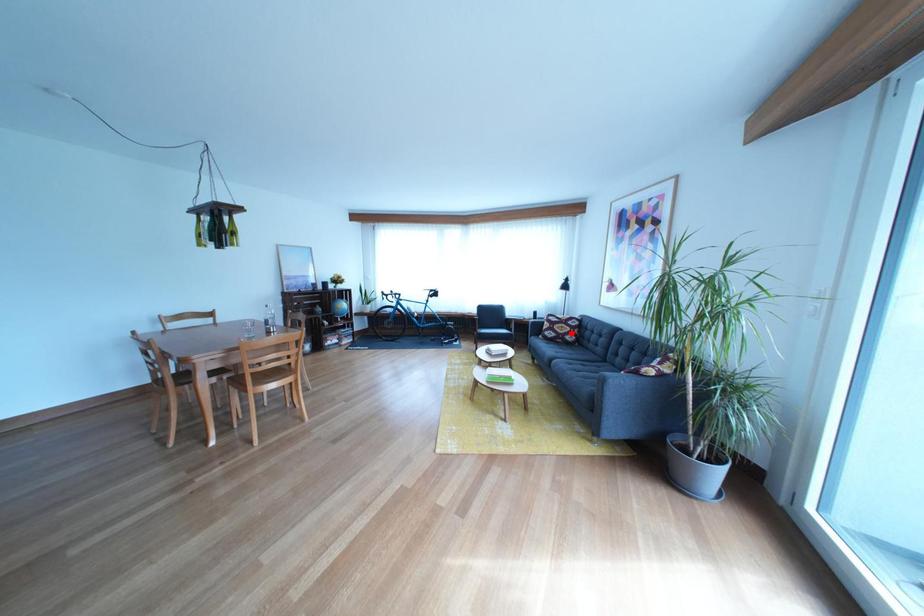
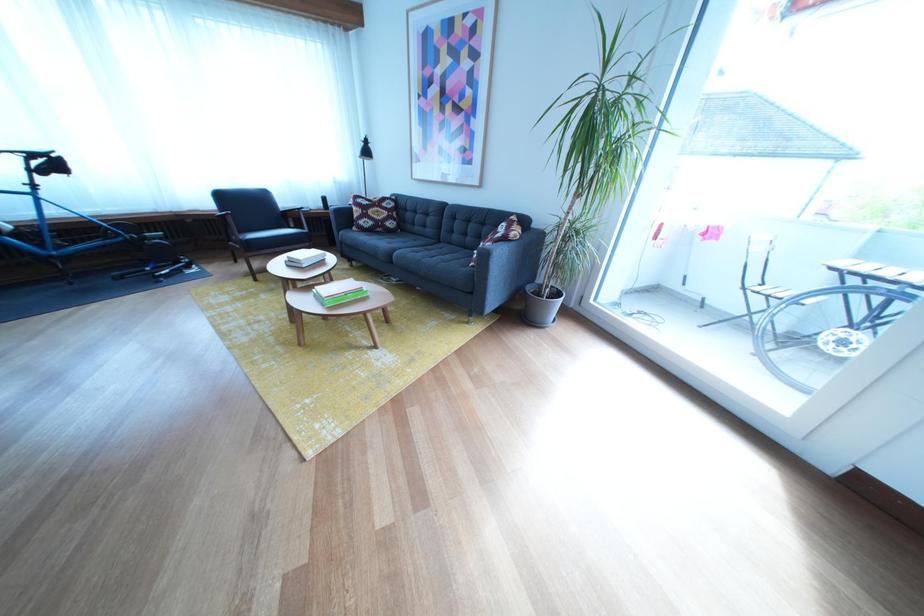
Question: A red point is marked in image1. In image2, is the corresponding 3D point closer to the camera or farther? Reply with the corresponding letter.

Choices:
 (A) The corresponding 3D point is closer.
 (B) The corresponding 3D point is farther.

Answer: (A)